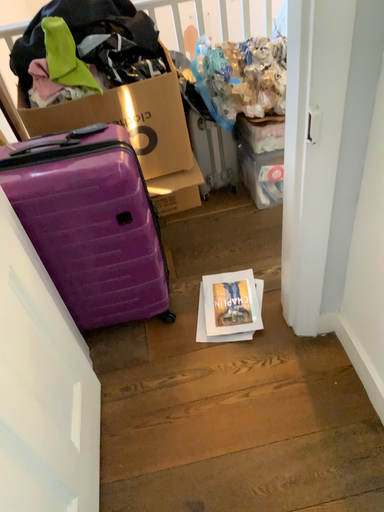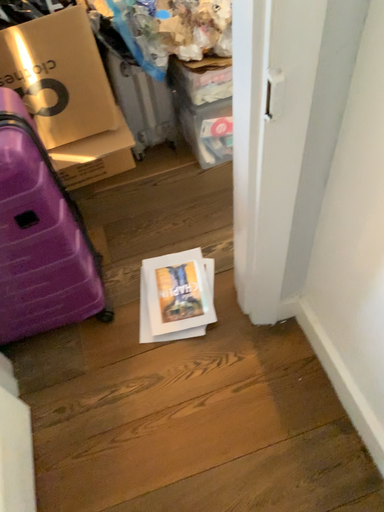
Question: How did the camera likely rotate when shooting the video?

Choices:
 (A) rotated left
 (B) rotated right

Answer: (B)